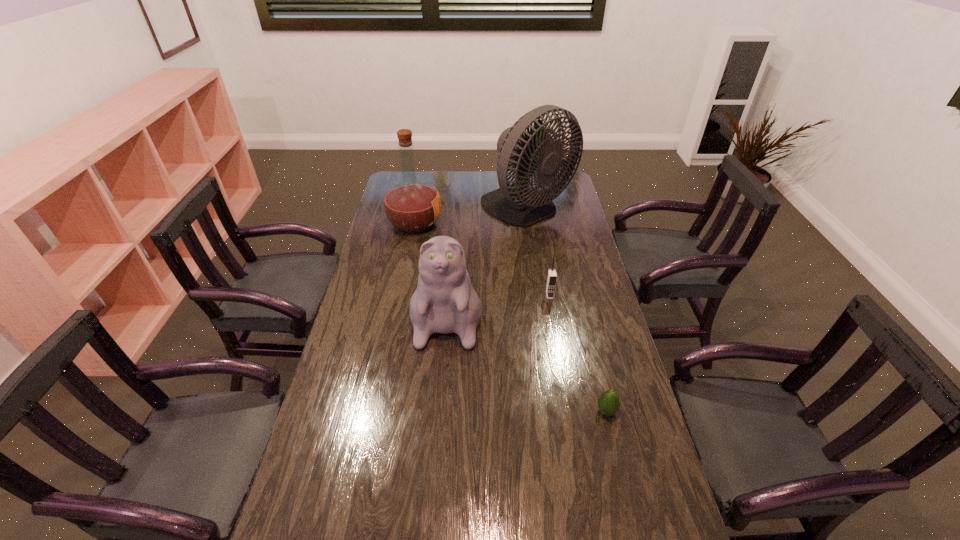
The image size is (960, 540). What are the coordinates of `free region that satisfies the following two spatial constraints: 1. in front of the nearest object to direct airflow; 2. on the right side of the fan` in the screenshot? It's located at (558, 411).

The height and width of the screenshot is (540, 960). I want to click on free point that satisfies the following two spatial constraints: 1. on the face of the cat; 2. on the right side of the nearest object, so click(440, 411).